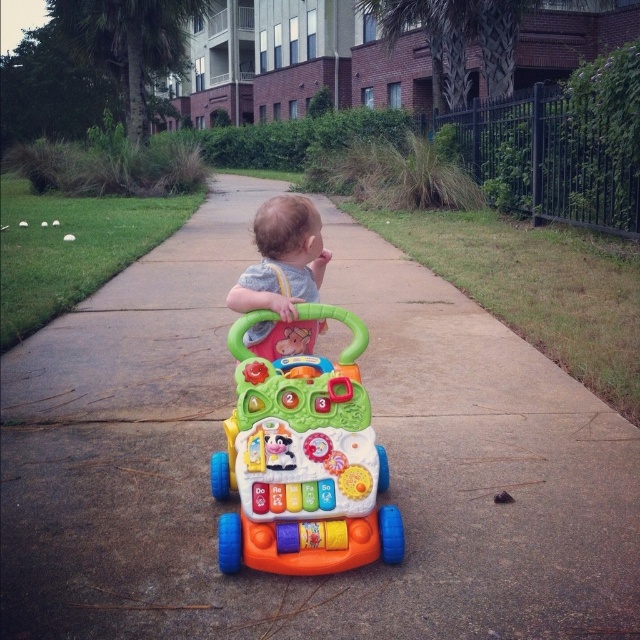
Between orange plastic walker at center and multicolored plastic walker at center, which one is positioned lower?

orange plastic walker at center is below.

Who is positioned more to the left, orange plastic walker at center or multicolored plastic walker at center?

orange plastic walker at center

The image size is (640, 640). I want to click on orange plastic walker at center, so click(x=378, y=440).

This screenshot has width=640, height=640. I want to click on orange plastic walker at center, so click(378, 440).

Does orange plastic walker at center appear over gray fabric baby at center?

Actually, orange plastic walker at center is below gray fabric baby at center.

Is orange plastic walker at center smaller than gray fabric baby at center?

Correct, orange plastic walker at center occupies less space than gray fabric baby at center.

Is point (36, 522) farther from viewer compared to point (305, 336)?

No, (36, 522) is in front of (305, 336).

This screenshot has width=640, height=640. I want to click on orange plastic walker at center, so click(x=378, y=440).

Is point (285, 545) behind point (326, 253)?

No, (285, 545) is in front of (326, 253).

Which of these two, multicolored plastic walker at center or gray fabric baby at center, stands shorter?

gray fabric baby at center

Between point (259, 540) and point (260, 230), which one is positioned behind?

The point (260, 230) is more distant.

Where is `multicolored plastic walker at center`? This screenshot has width=640, height=640. multicolored plastic walker at center is located at coordinates (301, 461).